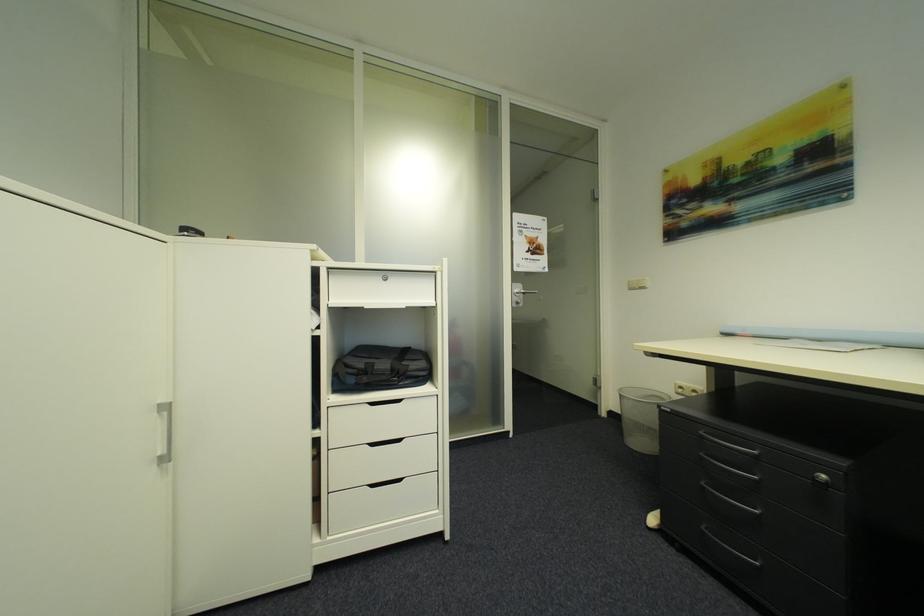
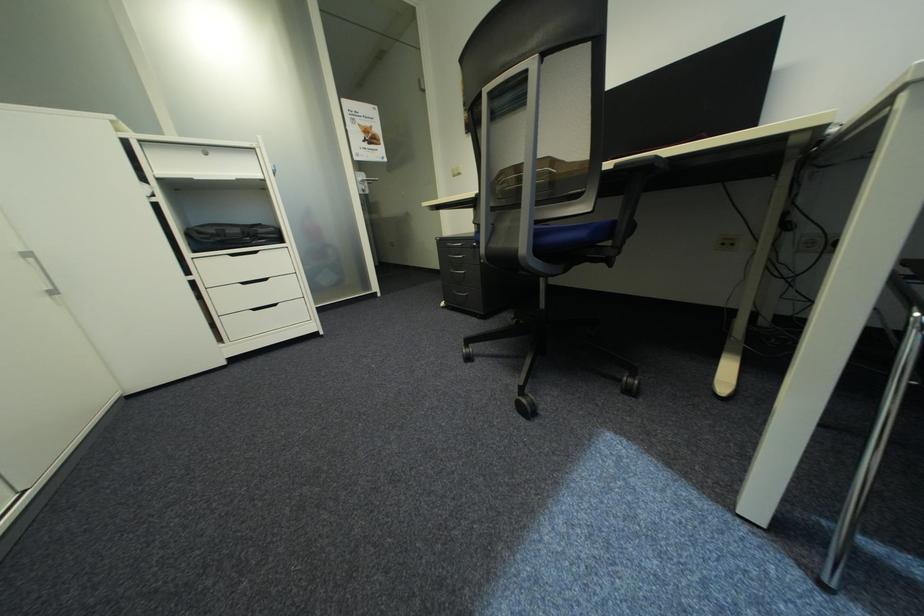
The first image is from the beginning of the video and the second image is from the end. How did the camera likely rotate when shooting the video?

The rotation direction of the camera is right-down.